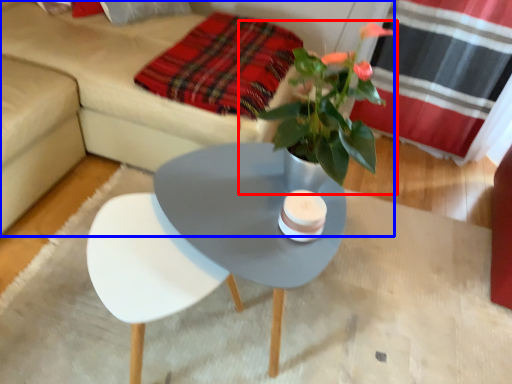
Question: Which object appears farthest to the camera in this image, houseplant (highlighted by a red box) or studio couch (highlighted by a blue box)?

Choices:
 (A) houseplant
 (B) studio couch

Answer: (B)